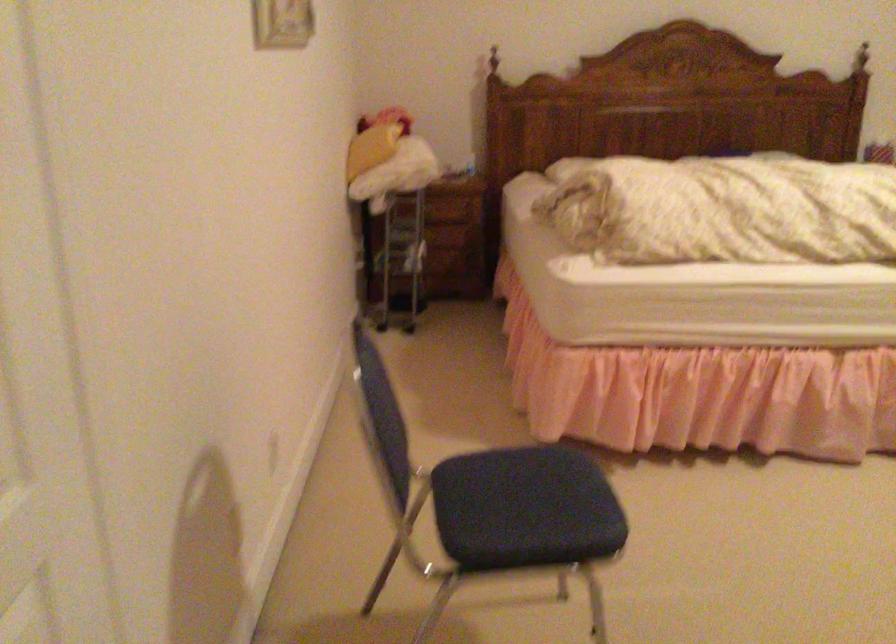
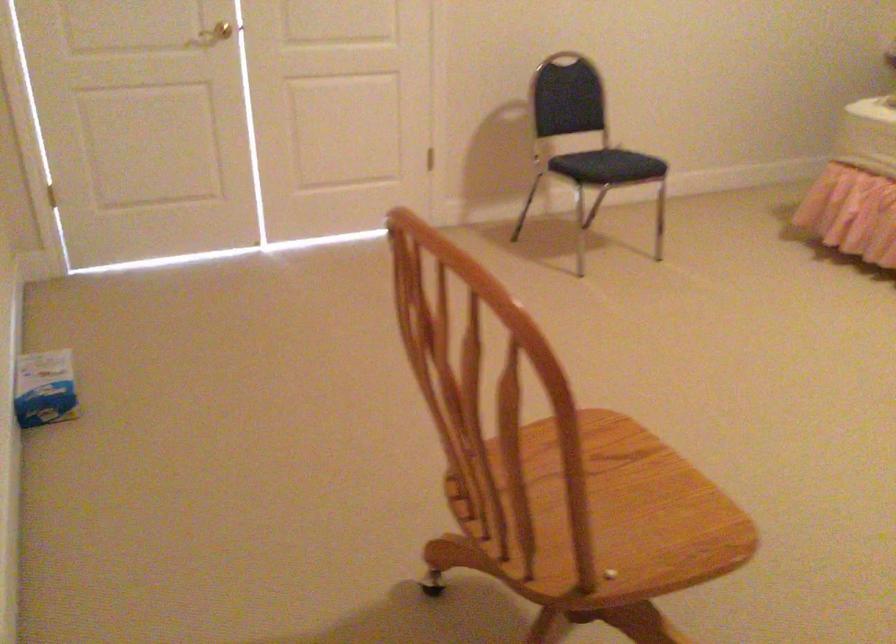
Where in the second image is the point corresponding to the point at 552,516 from the first image?

(607, 166)